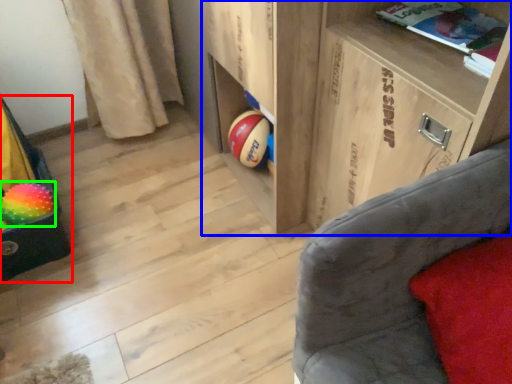
Question: Estimate the real-world distances between objects in this image. Which object is farther from bean bag chair (highlighted by a red box), shelf (highlighted by a blue box) or beach ball (highlighted by a green box)?

Choices:
 (A) shelf
 (B) beach ball

Answer: (A)